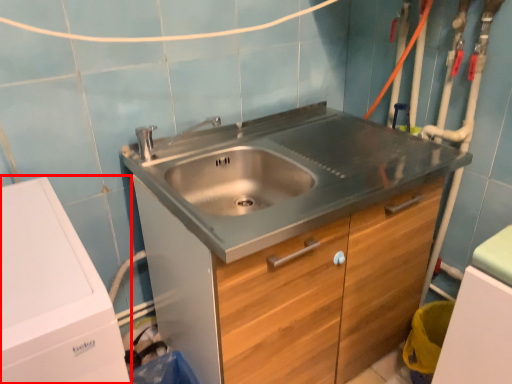
Question: Where is washing machine (annotated by the red box) located in relation to cabinetry in the image?

Choices:
 (A) left
 (B) right

Answer: (A)